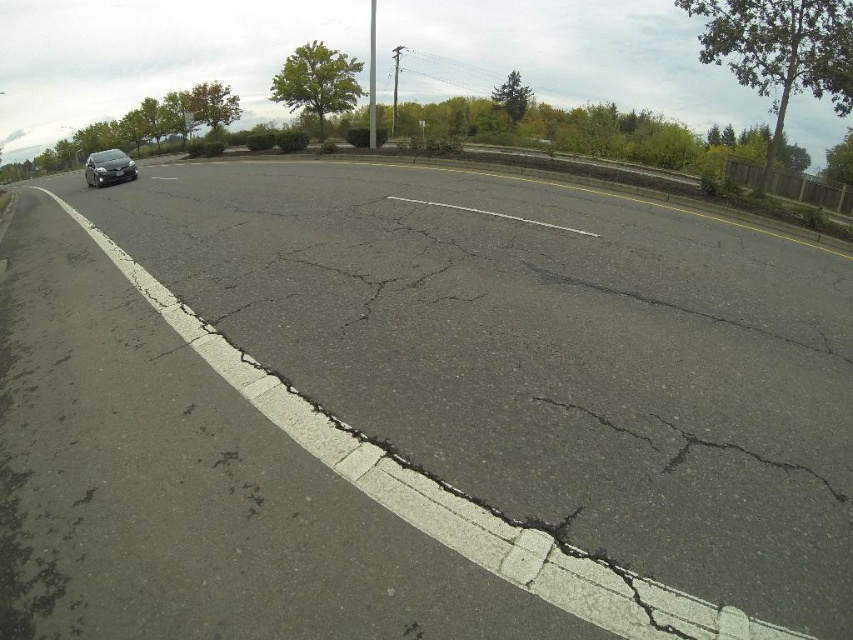
Find the location of `black asphalt crack at center`. black asphalt crack at center is located at coordinates (676, 307).

Locate an element on the screen. black asphalt crack at center is located at coordinates (676, 307).

Image resolution: width=853 pixels, height=640 pixels. I want to click on black asphalt crack at center, so click(x=676, y=307).